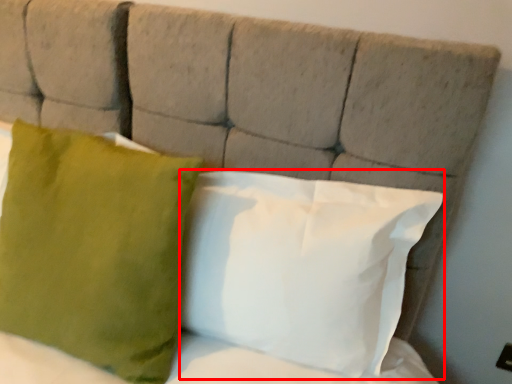
Question: Considering the relative positions of pillow (annotated by the red box) and pillow in the image provided, where is pillow (annotated by the red box) located with respect to the staircase?

Choices:
 (A) right
 (B) left

Answer: (A)